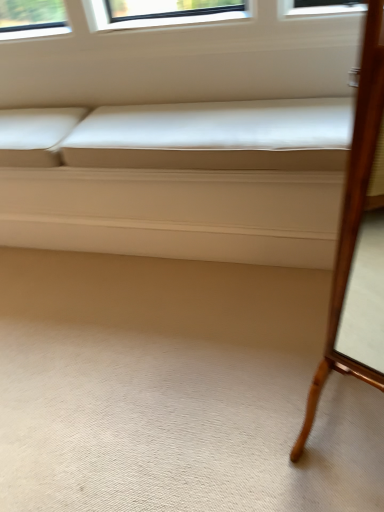
Question: In terms of width, does white leather couch at center look wider or thinner when compared to wooden mirror at right?

Choices:
 (A) thin
 (B) wide

Answer: (B)

Question: Is white leather couch at center taller or shorter than wooden mirror at right?

Choices:
 (A) short
 (B) tall

Answer: (A)

Question: In the image, is white leather couch at center positioned in front of or behind wooden mirror at right?

Choices:
 (A) front
 (B) behind

Answer: (B)

Question: Is wooden mirror at right wider or thinner than white leather couch at center?

Choices:
 (A) wide
 (B) thin

Answer: (B)

Question: Considering the positions of wooden mirror at right and white leather couch at center in the image, is wooden mirror at right taller or shorter than white leather couch at center?

Choices:
 (A) short
 (B) tall

Answer: (B)

Question: In the image, is wooden mirror at right on the left side or the right side of white leather couch at center?

Choices:
 (A) right
 (B) left

Answer: (A)

Question: Is point (339, 326) closer or farther from the camera than point (14, 176)?

Choices:
 (A) closer
 (B) farther

Answer: (A)